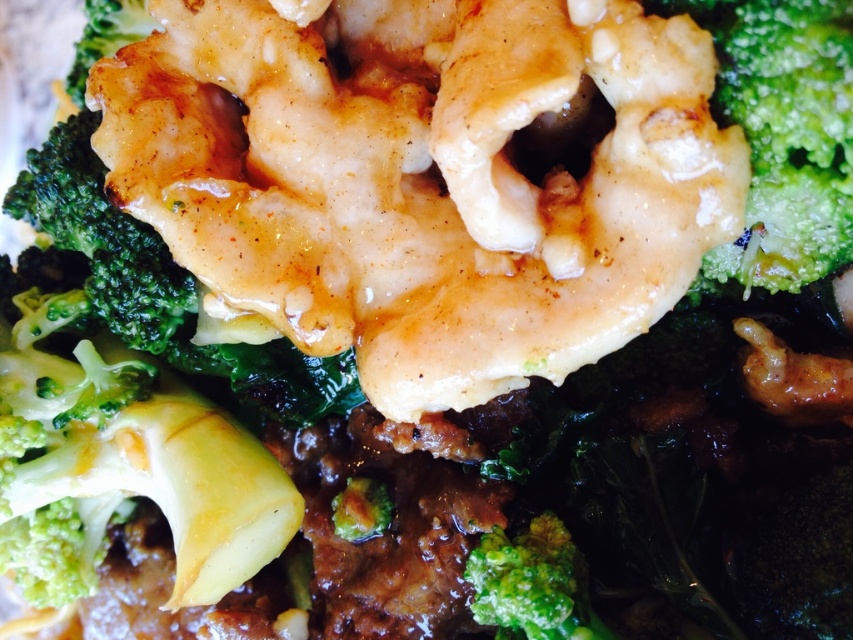
You are a food critic analyzing the dish layout. The glistening white shrimp at center is placed at a specific coordinate. Can you determine its exact location using the coordinate system where the bottom left corner is the origin?

The glistening white shrimp at center is located at coordinate point (422, 179).

You are a food critic analyzing the dish. You notice the glistening white shrimp at center and the green matte broccoli at center. Which ingredient is positioned higher in the dish?

The glistening white shrimp at center is above the green matte broccoli at center, so it is positioned higher in the dish.